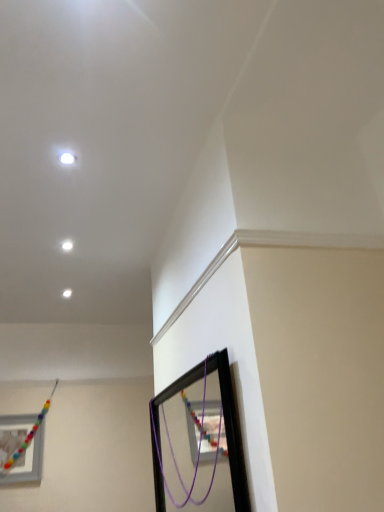
In order to face multicolored beads at left, should I rotate leftwards or rightwards?

Turn left by 21.439 degrees to look at multicolored beads at left.

You are a GUI agent. You are given a task and a screenshot of the screen. Output one action in this format:
    pyautogui.click(x=<x>, y=<y>)
    Task: Click on the multicolored beads at left
    Image resolution: width=384 pixels, height=512 pixels.
    Given the screenshot: What is the action you would take?
    pyautogui.click(x=28, y=435)

Image resolution: width=384 pixels, height=512 pixels. What do you see at coordinates (28, 435) in the screenshot? I see `multicolored beads at left` at bounding box center [28, 435].

The height and width of the screenshot is (512, 384). Identify the location of multicolored beads at left. (28, 435).